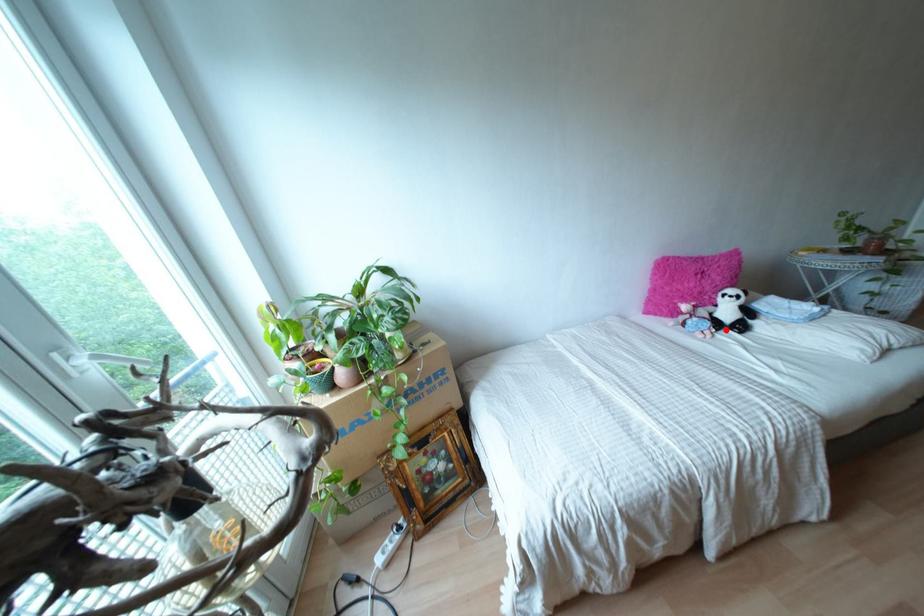
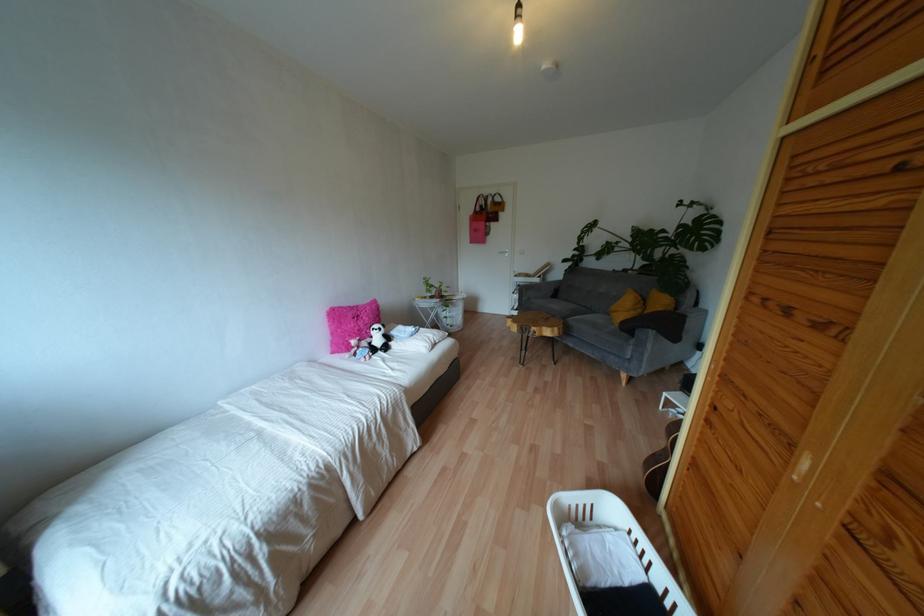
In the second image, find the point that corresponds to the highlighted location in the first image.

(379, 352)